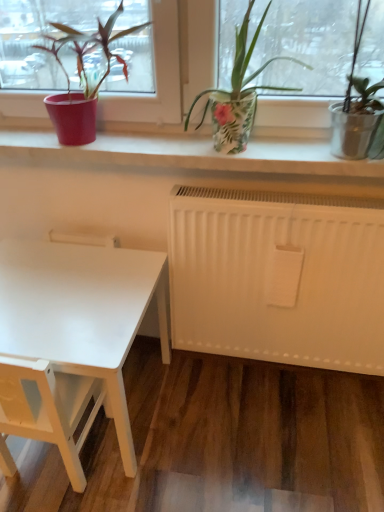
Question: Would you say white matte table at lower left is outside matte red pot at left, arranged as the 1th houseplant when viewed from the left?

Choices:
 (A) no
 (B) yes

Answer: (B)

Question: Does white matte table at lower left turn towards matte red pot at left, arranged as the 1th houseplant when viewed from the left?

Choices:
 (A) no
 (B) yes

Answer: (A)

Question: Does white matte table at lower left have a greater height compared to matte red pot at left, which is counted as the second houseplant, starting from the right?

Choices:
 (A) yes
 (B) no

Answer: (A)

Question: Is matte red pot at left, arranged as the 1th houseplant when viewed from the left, at the back of white matte table at lower left?

Choices:
 (A) no
 (B) yes

Answer: (A)

Question: From the image's perspective, is white matte table at lower left located beneath matte red pot at left, which is counted as the second houseplant, starting from the right?

Choices:
 (A) yes
 (B) no

Answer: (A)

Question: Can you confirm if white matte table at lower left is shorter than matte red pot at left, arranged as the 1th houseplant when viewed from the left?

Choices:
 (A) no
 (B) yes

Answer: (A)

Question: Is white matte table at lower left at the back of white matte table at lower left?

Choices:
 (A) yes
 (B) no

Answer: (A)

Question: Is there a large distance between white matte table at lower left and white matte table at lower left?

Choices:
 (A) no
 (B) yes

Answer: (A)

Question: Would you say white matte table at lower left is part of white matte table at lower left's contents?

Choices:
 (A) no
 (B) yes

Answer: (A)

Question: From the image's perspective, would you say white matte table at lower left is positioned over white matte table at lower left?

Choices:
 (A) no
 (B) yes

Answer: (A)

Question: Considering the relative positions of white matte table at lower left and white matte table at lower left in the image provided, is white matte table at lower left to the right of white matte table at lower left from the viewer's perspective?

Choices:
 (A) yes
 (B) no

Answer: (B)

Question: Could you tell me if white matte table at lower left is turned towards white matte table at lower left?

Choices:
 (A) no
 (B) yes

Answer: (B)

Question: From a real-world perspective, is floral-patterned pot at center, the first houseplant in the right-to-left sequence, located beneath white matte table at lower left?

Choices:
 (A) yes
 (B) no

Answer: (B)